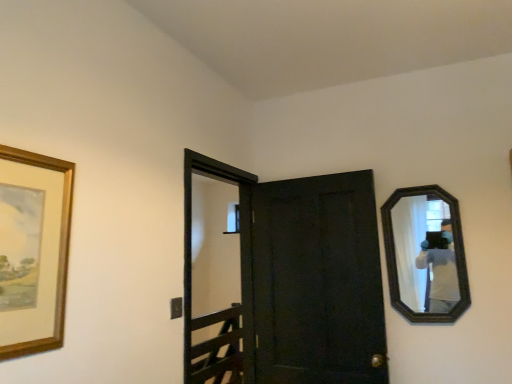
Question: From a real-world perspective, relative to dark wood mirror at right, is wooden picture frame at left vertically above or below?

Choices:
 (A) below
 (B) above

Answer: (B)

Question: In terms of size, does wooden picture frame at left appear bigger or smaller than dark wood mirror at right?

Choices:
 (A) big
 (B) small

Answer: (B)

Question: Considering the real-world distances, which object is farthest from the dark wood mirror at right?

Choices:
 (A) matte black door at center
 (B) wooden picture frame at left
 (C) black wooden screen door at center

Answer: (B)

Question: Which is farther from the black wooden screen door at center?

Choices:
 (A) dark wood mirror at right
 (B) matte black door at center
 (C) wooden picture frame at left

Answer: (C)